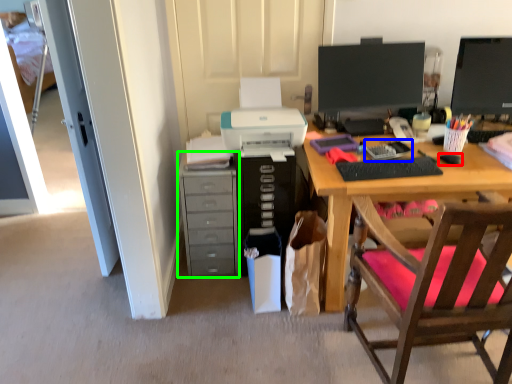
Question: Estimate the real-world distances between objects in this image. Which object is closer to mouse (highlighted by a red box), office supplies (highlighted by a blue box) or cabinetry (highlighted by a green box)?

Choices:
 (A) office supplies
 (B) cabinetry

Answer: (A)